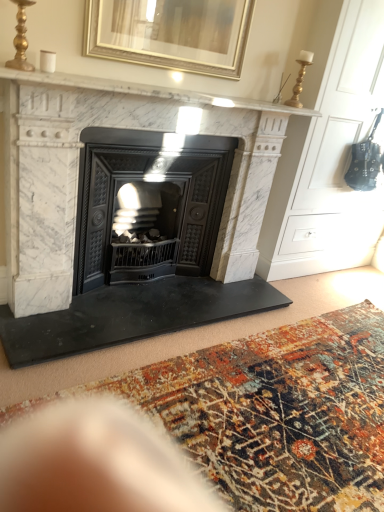
Question: In terms of height, does black cast iron wood burning stove at center look taller or shorter compared to multicolored woven rug at center?

Choices:
 (A) tall
 (B) short

Answer: (A)

Question: Is black cast iron wood burning stove at center spatially inside multicolored woven rug at center, or outside of it?

Choices:
 (A) outside
 (B) inside

Answer: (A)

Question: Estimate the real-world distances between objects in this image. Which object is closer to the black cast iron wood burning stove at center?

Choices:
 (A) multicolored woven rug at center
 (B) white marble fireplace at center
 (C) gold metallic picture frame at upper center
 (D) white marble fireplace at upper center

Answer: (B)

Question: Estimate the real-world distances between objects in this image. Which object is closer to the white marble fireplace at upper center?

Choices:
 (A) black cast iron wood burning stove at center
 (B) white marble fireplace at center
 (C) multicolored woven rug at center
 (D) gold metallic picture frame at upper center

Answer: (D)